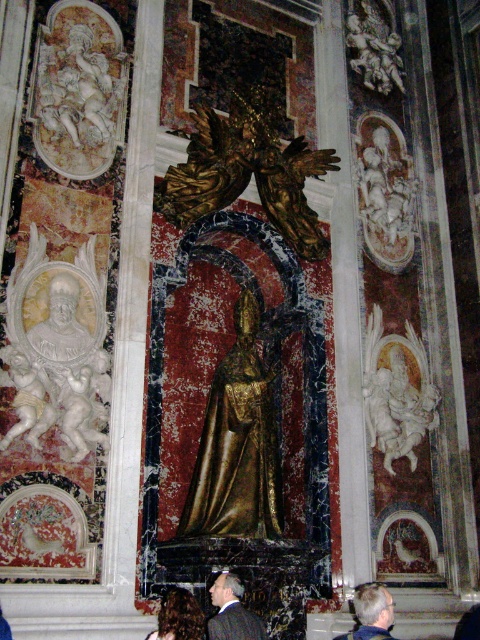
You are standing in the historical building and want to take a photo of the golden statue. The camera you are using has a maximum focus range of 25 meters. Can you focus on the point at coordinates point (x=236, y=636)?

The point at coordinates point (x=236, y=636) is 28.84 meters away from the camera, which exceeds the maximum focus range of 25 meters. Therefore, the camera cannot focus on that point.

You are standing in the historical building and want to take a photo of the dark suit at center. Where should you position yourself to capture it in the frame?

To capture the dark suit at center in the frame, position yourself directly in front of it since it is located at the center of the scene.

You are an art student visiting this historical building. You need to sketch both the gold polished statue at center and the white marble statue at right. Based on their positions, which statue should you focus on first to avoid blocking your view of the other?

The gold polished statue at center is located above the white marble statue at right. Therefore, you should sketch the white marble statue at right first, as it is lower and less likely to be obscured by the gold polished statue at center when you move to draw the latter.